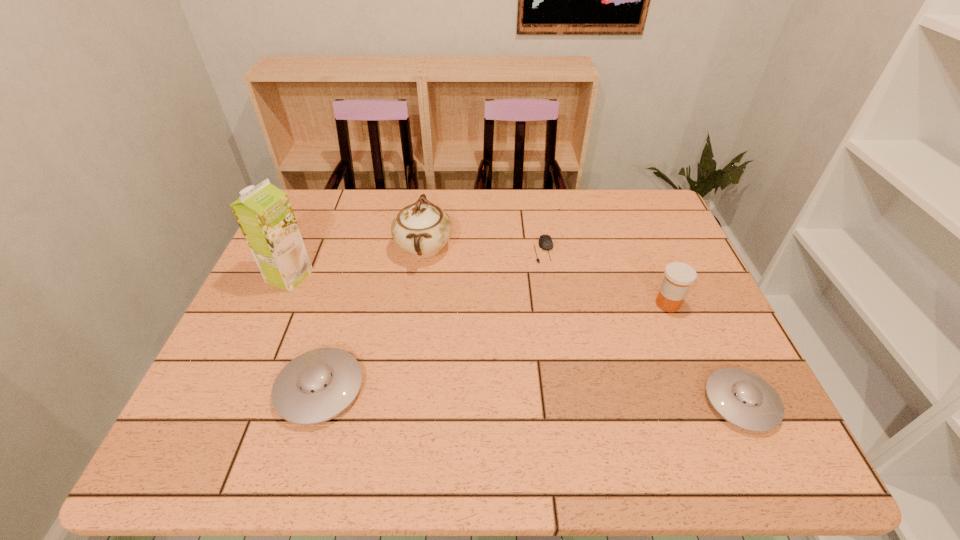
Locate an element on the screen. the second object from left to right is located at coordinates (316, 386).

At what (x,y) coordinates should I click in order to perform the action: click on the fourth tallest object. Please return your answer as a coordinate pair (x, y). Looking at the image, I should click on (316, 386).

At what (x,y) coordinates should I click in order to perform the action: click on the second shortest object. Please return your answer as a coordinate pair (x, y). Looking at the image, I should click on (742, 398).

Locate an element on the screen. the shorter saucer is located at coordinates (742, 398).

Locate an element on the screen. The image size is (960, 540). chinaware is located at coordinates (422, 229).

Image resolution: width=960 pixels, height=540 pixels. In order to click on the fourth object from right to left in this screenshot , I will do (x=422, y=229).

You are a GUI agent. You are given a task and a screenshot of the screen. Output one action in this format:
    pyautogui.click(x=<x>, y=<y>)
    Task: Click on the mouse
    
    Given the screenshot: What is the action you would take?
    point(545,242)

The width and height of the screenshot is (960, 540). Find the location of `the fourth object from left to right`. the fourth object from left to right is located at coordinates [545, 242].

Identify the location of the fourth farthest object. (679, 276).

The width and height of the screenshot is (960, 540). I want to click on the fourth shortest object, so click(x=679, y=276).